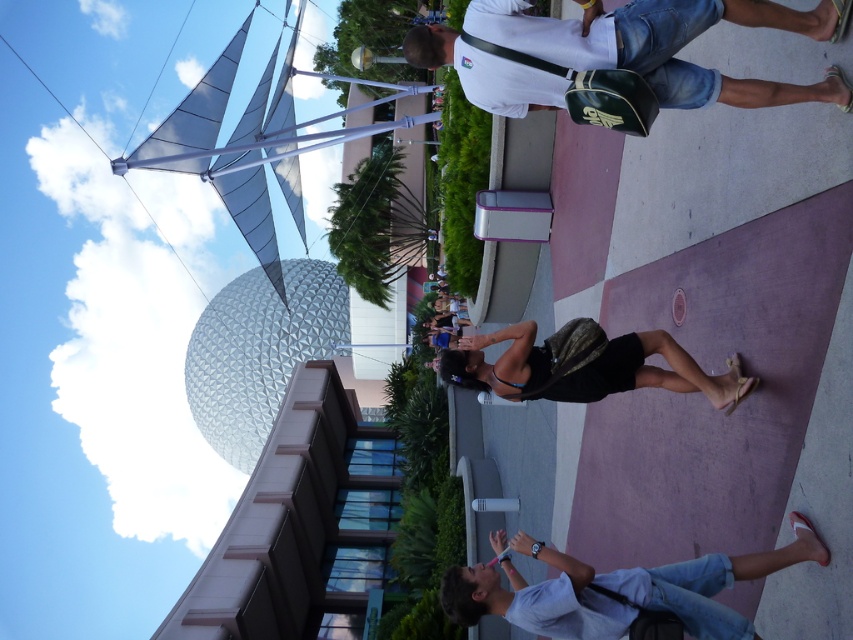
Question: From the image, what is the correct spatial relationship of white matte shirt at upper center in relation to white cotton shirt at lower right?

Choices:
 (A) above
 (B) below

Answer: (A)

Question: Among these points, which one is nearest to the camera?

Choices:
 (A) (564, 33)
 (B) (490, 609)

Answer: (A)

Question: Which point is closer to the camera?

Choices:
 (A) black fabric bag at center
 (B) white matte shirt at upper center

Answer: (B)

Question: Does white matte shirt at upper center come behind white cotton shirt at lower right?

Choices:
 (A) no
 (B) yes

Answer: (A)

Question: Which object is the farthest from the black fabric bag at center?

Choices:
 (A) white matte shirt at upper center
 (B) white cotton shirt at lower right

Answer: (A)

Question: Is white matte shirt at upper center further to the viewer compared to black fabric bag at center?

Choices:
 (A) yes
 (B) no

Answer: (B)